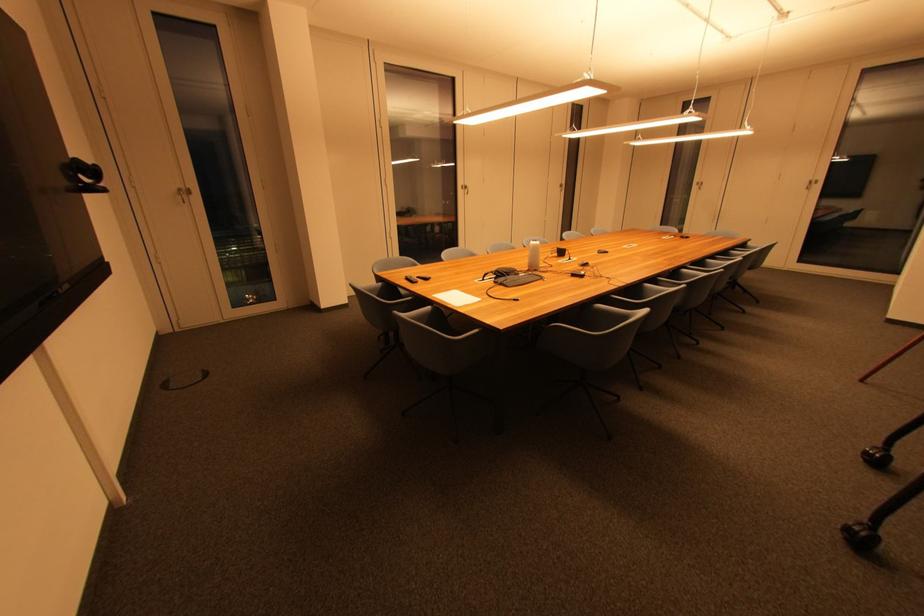
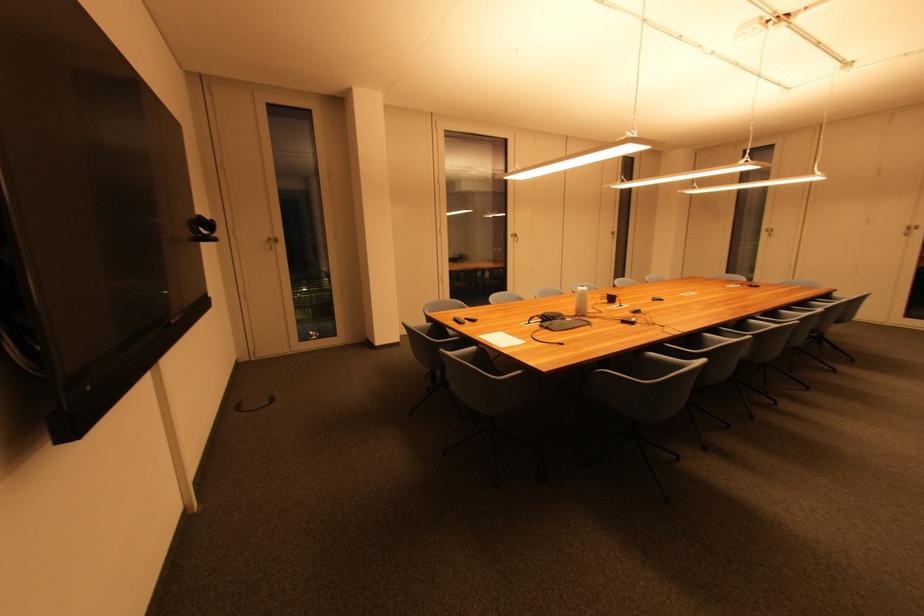
Question: Which direction would the cameraman need to move to produce the second image? Reply with the corresponding letter.

Choices:
 (A) Left
 (B) Right
 (C) Forward
 (D) Backward

Answer: (D)